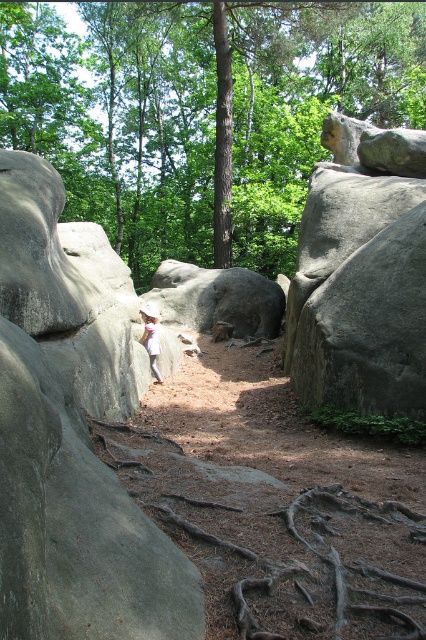
You are a hiker trying to navigate through the narrow path between the gray rough rock at left and the white cotton shirt at center. Which object should you avoid bumping into first as you move forward?

You should avoid bumping into the gray rough rock at left first because it is closer to the viewer than the white cotton shirt at center.